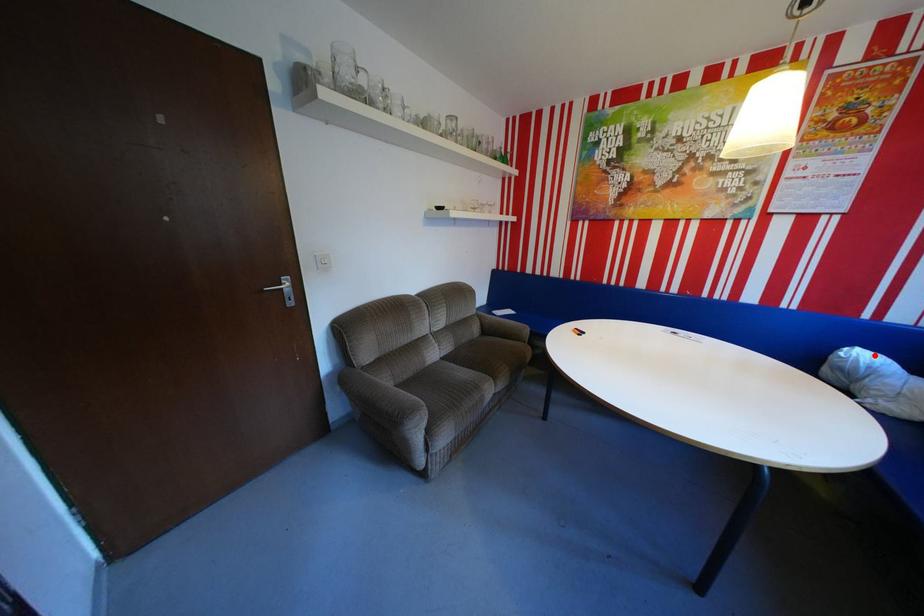
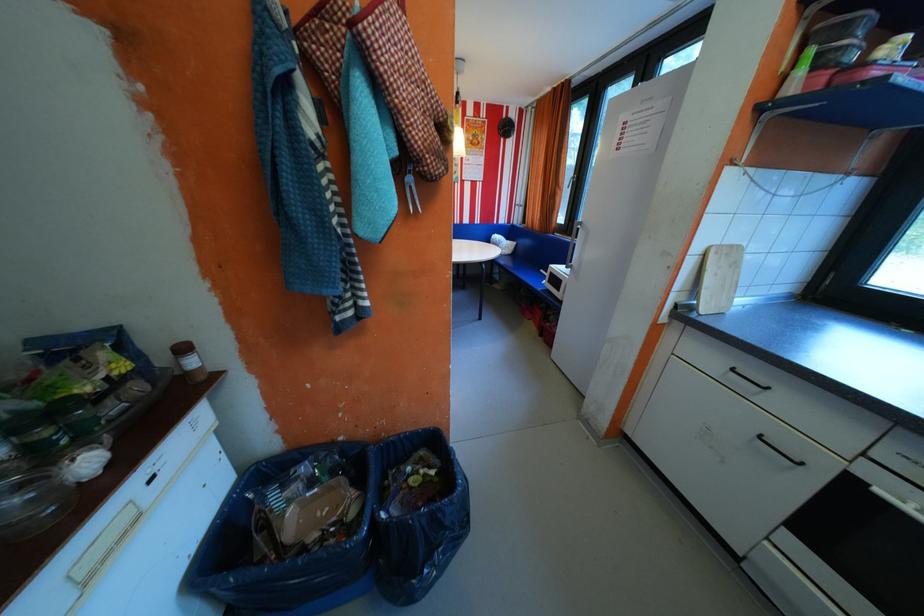
Question: I am providing you with two images of the same scene from different viewpoints. Image1 has a red point marked. In image2, the corresponding 3D location appears at what relative position? Reply with the corresponding letter.

Choices:
 (A) Closer
 (B) Farther

Answer: (A)